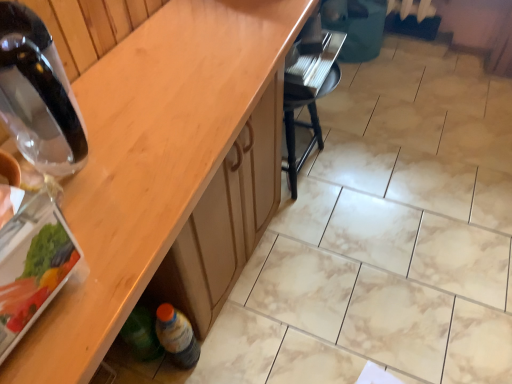
You are a GUI agent. You are given a task and a screenshot of the screen. Output one action in this format:
    pyautogui.click(x=<x>, y=<y>)
    Task: Click on the transparent glass bottle at left, which is the 2th bottle from bottom to top
    The height and width of the screenshot is (384, 512).
    Given the screenshot: What is the action you would take?
    pyautogui.click(x=38, y=94)

The width and height of the screenshot is (512, 384). What do you see at coordinates (151, 161) in the screenshot?
I see `wooden at lower left` at bounding box center [151, 161].

Measure the distance between translucent plastic bottle at lower left, placed as the 2th bottle when sorted from top to bottom, and camera.

translucent plastic bottle at lower left, placed as the 2th bottle when sorted from top to bottom, is 3.37 feet away from camera.

What is the approximate height of black plastic chair at center?

It is 17.09 inches.

The image size is (512, 384). What are the coordinates of `transparent glass bottle at left, which is the second bottle from back to front` in the screenshot? It's located at (38, 94).

From the image's perspective, who appears lower, black plastic chair at center or translucent plastic bottle at lower left, marked as the 1th bottle in a bottom-to-top arrangement?

translucent plastic bottle at lower left, marked as the 1th bottle in a bottom-to-top arrangement, from the image's perspective.

Is black plastic chair at center not inside translucent plastic bottle at lower left, which is the 2th bottle from front to back?

black plastic chair at center lies outside translucent plastic bottle at lower left, which is the 2th bottle from front to back,'s area.

Which is less distant, (x=333, y=72) or (x=177, y=365)?

Point (x=333, y=72) is farther from the camera than point (x=177, y=365).

Considering the relative sizes of black plastic chair at center and translucent plastic bottle at lower left, the first bottle from the back, in the image provided, is black plastic chair at center shorter than translucent plastic bottle at lower left, the first bottle from the back,?

No.

From the picture: How different are the orientations of wooden at lower left and transparent glass bottle at left, the first bottle viewed from the front, in degrees?

0.307 degrees separate the facing orientations of wooden at lower left and transparent glass bottle at left, the first bottle viewed from the front.

Is wooden at lower left to the left of transparent glass bottle at left, which is the second bottle from back to front, from the viewer's perspective?

No, wooden at lower left is not to the left of transparent glass bottle at left, which is the second bottle from back to front.

Is wooden at lower left inside the boundaries of transparent glass bottle at left, which is the second bottle from back to front, or outside?

wooden at lower left exists outside the volume of transparent glass bottle at left, which is the second bottle from back to front.

From the image's perspective, is wooden at lower left located above or below transparent glass bottle at left, positioned as the 1th bottle in top-to-bottom order?

From the image's perspective, wooden at lower left appears below transparent glass bottle at left, positioned as the 1th bottle in top-to-bottom order.

From the image's perspective, is wooden at lower left positioned above or below translucent plastic bottle at lower left, placed as the 2th bottle when sorted from top to bottom?

wooden at lower left is above translucent plastic bottle at lower left, placed as the 2th bottle when sorted from top to bottom.

Is the surface of wooden at lower left in direct contact with translucent plastic bottle at lower left, placed as the 2th bottle when sorted from top to bottom?

wooden at lower left and translucent plastic bottle at lower left, placed as the 2th bottle when sorted from top to bottom, are not in contact.

Can you confirm if wooden at lower left is shorter than translucent plastic bottle at lower left, marked as the 1th bottle in a bottom-to-top arrangement?

In fact, wooden at lower left may be taller than translucent plastic bottle at lower left, marked as the 1th bottle in a bottom-to-top arrangement.

Is wooden at lower left smaller than translucent plastic bottle at lower left, marked as the 1th bottle in a bottom-to-top arrangement?

No.

Between translucent plastic bottle at lower left, which is the 2th bottle from front to back, and transparent glass bottle at left, which is the second bottle from back to front, which one has more height?

translucent plastic bottle at lower left, which is the 2th bottle from front to back, is taller.

Is translucent plastic bottle at lower left, marked as the 1th bottle in a bottom-to-top arrangement, closer to camera compared to transparent glass bottle at left, the first bottle viewed from the front?

No, it is behind transparent glass bottle at left, the first bottle viewed from the front.

Can you tell me how much translucent plastic bottle at lower left, placed as the 2th bottle when sorted from top to bottom, and transparent glass bottle at left, which is the 2th bottle from bottom to top, differ in facing direction?

The facing directions of translucent plastic bottle at lower left, placed as the 2th bottle when sorted from top to bottom, and transparent glass bottle at left, which is the 2th bottle from bottom to top, are 2.77 degrees apart.

Is translucent plastic bottle at lower left, marked as the 1th bottle in a bottom-to-top arrangement, touching transparent glass bottle at left, the first bottle viewed from the front?

translucent plastic bottle at lower left, marked as the 1th bottle in a bottom-to-top arrangement, is not next to transparent glass bottle at left, the first bottle viewed from the front, and they're not touching.

Could you tell me if transparent glass bottle at left, which is the second bottle from back to front, is turned towards black plastic chair at center?

No, transparent glass bottle at left, which is the second bottle from back to front, does not turn towards black plastic chair at center.

From a real-world perspective, does transparent glass bottle at left, the first bottle viewed from the front, sit lower than black plastic chair at center?

No.

Does transparent glass bottle at left, which is the second bottle from back to front, come behind black plastic chair at center?

No.

Based on the photo, can you confirm if transparent glass bottle at left, which is the 2th bottle from bottom to top, is bigger than black plastic chair at center?

Actually, transparent glass bottle at left, which is the 2th bottle from bottom to top, might be smaller than black plastic chair at center.

From the black plastic chair at center, count 1st bottles forward and point to it. Please provide its 2D coordinates.

[(176, 336)]

Does translucent plastic bottle at lower left, the first bottle from the back, lie behind black plastic chair at center?

No, translucent plastic bottle at lower left, the first bottle from the back, is closer to the camera.

Consider the image. From a real-world perspective, who is located higher, translucent plastic bottle at lower left, the first bottle from the back, or black plastic chair at center?

black plastic chair at center is physically above.

From a real-world perspective, which object rests below the other?

From a 3D spatial view, translucent plastic bottle at lower left, which is the 2th bottle from front to back, is below.

From the image's perspective, is transparent glass bottle at left, which is the 2th bottle from bottom to top, on translucent plastic bottle at lower left, marked as the 1th bottle in a bottom-to-top arrangement?

Indeed, from the image's perspective, transparent glass bottle at left, which is the 2th bottle from bottom to top, is shown above translucent plastic bottle at lower left, marked as the 1th bottle in a bottom-to-top arrangement.

Based on the photo, which of these two, transparent glass bottle at left, which is the 2th bottle from bottom to top, or translucent plastic bottle at lower left, placed as the 2th bottle when sorted from top to bottom, is wider?

Wider between the two is transparent glass bottle at left, which is the 2th bottle from bottom to top.

At what (x,y) coordinates should I click in order to perform the action: click on chair located above the translucent plastic bottle at lower left, which is the 2th bottle from front to back (from a real-world perspective). Please return your answer as a coordinate pair (x, y). Image resolution: width=512 pixels, height=384 pixels. Looking at the image, I should click on (309, 97).

Where is `countertop on the right of transparent glass bottle at left, which is the 2th bottle from bottom to top`? countertop on the right of transparent glass bottle at left, which is the 2th bottle from bottom to top is located at coordinates (151, 161).

Consider the image. When comparing their distances from translucent plastic bottle at lower left, placed as the 2th bottle when sorted from top to bottom, does transparent glass bottle at left, which is the second bottle from back to front, or black plastic chair at center seem closer?

transparent glass bottle at left, which is the second bottle from back to front.

Based on their spatial positions, is translucent plastic bottle at lower left, which is the 2th bottle from front to back, or wooden at lower left further from black plastic chair at center?

translucent plastic bottle at lower left, which is the 2th bottle from front to back.

When comparing their distances from black plastic chair at center, does wooden at lower left or transparent glass bottle at left, which is the 2th bottle from bottom to top, seem further?

transparent glass bottle at left, which is the 2th bottle from bottom to top, is positioned further to the anchor black plastic chair at center.

Estimate the real-world distances between objects in this image. Which object is further from black plastic chair at center, wooden at lower left or translucent plastic bottle at lower left, which is the 2th bottle from front to back?

translucent plastic bottle at lower left, which is the 2th bottle from front to back, is further to black plastic chair at center.

From the image, which object appears to be nearer to wooden at lower left, transparent glass bottle at left, which is the 2th bottle from bottom to top, or black plastic chair at center?

transparent glass bottle at left, which is the 2th bottle from bottom to top, is closer to wooden at lower left.

From the image, which object appears to be farther from transparent glass bottle at left, positioned as the 1th bottle in top-to-bottom order, translucent plastic bottle at lower left, the first bottle from the back, or wooden at lower left?

Among the two, translucent plastic bottle at lower left, the first bottle from the back, is located further to transparent glass bottle at left, positioned as the 1th bottle in top-to-bottom order.

When comparing their distances from translucent plastic bottle at lower left, which is the 2th bottle from front to back, does transparent glass bottle at left, positioned as the 1th bottle in top-to-bottom order, or wooden at lower left seem further?

transparent glass bottle at left, positioned as the 1th bottle in top-to-bottom order, is further to translucent plastic bottle at lower left, which is the 2th bottle from front to back.

From the image, which object appears to be nearer to translucent plastic bottle at lower left, which is the 2th bottle from front to back, black plastic chair at center or wooden at lower left?

wooden at lower left is closer to translucent plastic bottle at lower left, which is the 2th bottle from front to back.

What are the coordinates of `countertop between transparent glass bottle at left, which is the second bottle from back to front, and translucent plastic bottle at lower left, placed as the 2th bottle when sorted from top to bottom, in the up-down direction` in the screenshot? It's located at (151, 161).

In order to click on bottle located between transparent glass bottle at left, positioned as the 1th bottle in top-to-bottom order, and black plastic chair at center in the depth direction in this screenshot , I will do `click(176, 336)`.